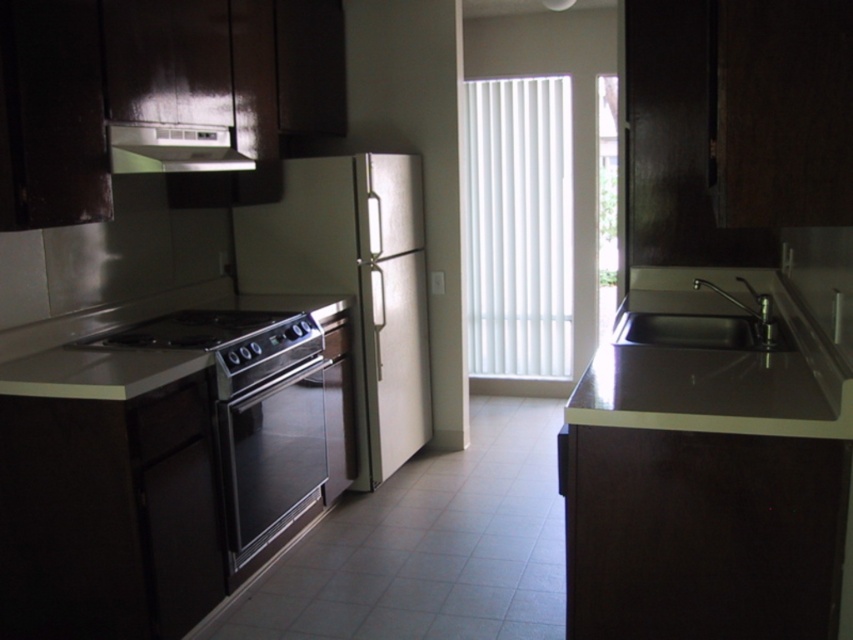
You are planning to move the satin silver refrigerator at center and the black stainless steel sink at right to a new kitchen layout. If you want to place both appliances side by side along a wall, which appliance should be placed first to ensure they fit properly?

The satin silver refrigerator at center is wider than the black stainless steel sink at right. Therefore, you should place the satin silver refrigerator at center first to accommodate its larger width before positioning the black stainless steel sink at right next to it.

You are standing in the kitchen and need to place a new microwave next to the satin silver refrigerator at center. According to the kitchen layout, where should you position the microwave relative to the refrigerator?

The satin silver refrigerator at center is located at point (355, 284), so you should position the microwave to the right side of the refrigerator since there is space available in that direction based on the coordinates provided.

You are standing in the kitchen and see two points marked on the floor tiles. The first point is at coordinate point (405, 394) and the second is at point (753, 296). Which point is closer to you?

Point (405, 394) is closer to you because it is further to the viewer than point (753, 296).